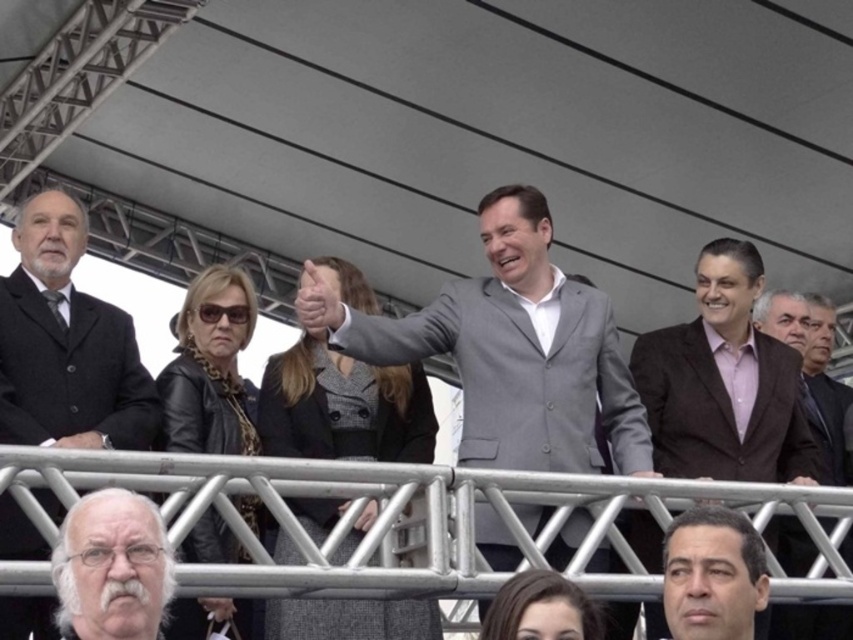
Question: Where is silver metallic rail at center located in relation to brown textured suit at right in the image?

Choices:
 (A) below
 (B) above

Answer: (A)

Question: Which object is the closest to the silver metallic rail at center?

Choices:
 (A) gray suit at center
 (B) black wool suit at left
 (C) brown textured suit at right

Answer: (A)

Question: Which is farther from the gray woolen blazer at center?

Choices:
 (A) silver metallic rail at center
 (B) black wool suit at left

Answer: (B)

Question: Which object is farther from the camera taking this photo?

Choices:
 (A) gray suit at center
 (B) gray woolen blazer at center
 (C) silver metallic rail at center

Answer: (A)

Question: From the image, what is the correct spatial relationship of gray suit at center in relation to black wool suit at left?

Choices:
 (A) right
 (B) left

Answer: (A)

Question: Is the position of gray suit at center less distant than that of black wool suit at left?

Choices:
 (A) no
 (B) yes

Answer: (A)